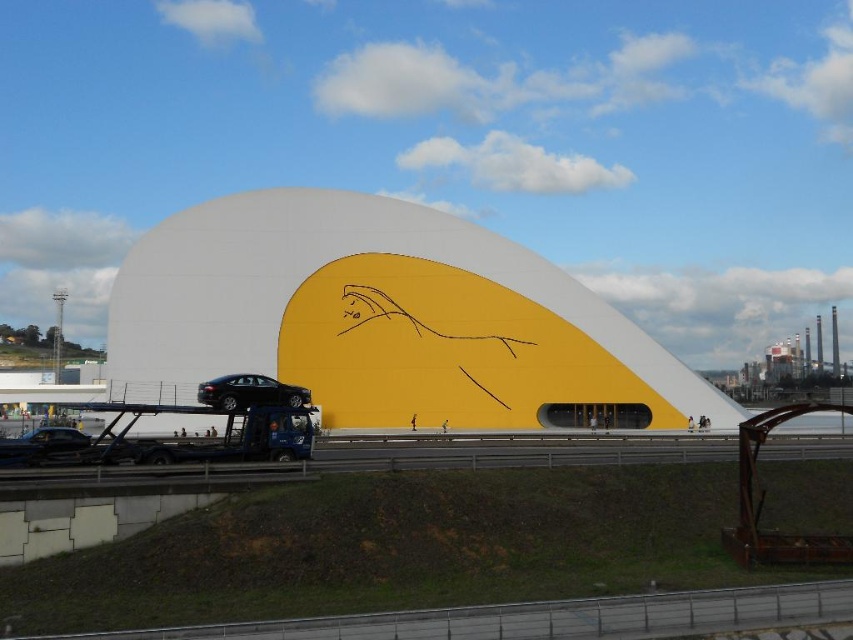
Question: Is glossy black car at center closer to camera compared to shiny black car at lower left?

Choices:
 (A) yes
 (B) no

Answer: (B)

Question: In this image, where is white matte dome at center located relative to glossy black car at center?

Choices:
 (A) left
 (B) right

Answer: (B)

Question: Based on their relative distances, which object is nearer to the glossy black car at center?

Choices:
 (A) shiny black car at lower left
 (B) white matte dome at center

Answer: (A)

Question: Can you confirm if glossy black car at center is bigger than shiny black car at lower left?

Choices:
 (A) no
 (B) yes

Answer: (A)

Question: Which point is farther from the camera taking this photo?

Choices:
 (A) (0, 458)
 (B) (289, 392)

Answer: (B)

Question: Which is farther from the glossy black car at center?

Choices:
 (A) shiny black car at lower left
 (B) white matte dome at center

Answer: (B)